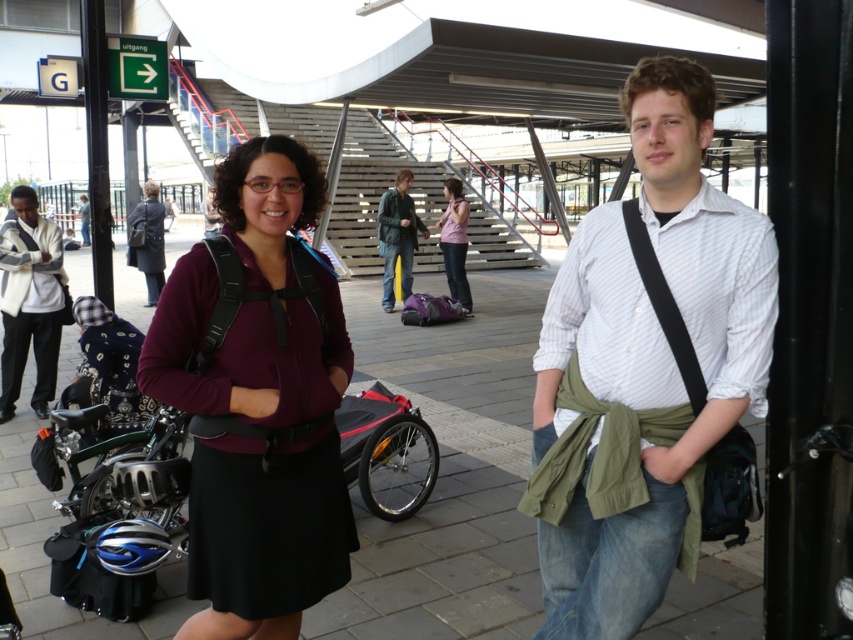
Can you confirm if smooth concrete pavement at center is positioned to the left of matte black backpack at center?

Yes, smooth concrete pavement at center is to the left of matte black backpack at center.

Is smooth concrete pavement at center positioned in front of matte black backpack at center?

No, it is behind matte black backpack at center.

This screenshot has width=853, height=640. Find the location of `smooth concrete pavement at center`. smooth concrete pavement at center is located at coordinates (450, 472).

Can you confirm if matte black backpack at center is positioned to the left of green matte jacket at center?

Incorrect, matte black backpack at center is not on the left side of green matte jacket at center.

In the scene shown: Does matte black backpack at center have a larger size compared to green matte jacket at center?

Incorrect, matte black backpack at center is not larger than green matte jacket at center.

Measure the distance between matte black backpack at center and camera.

6.47 feet

Locate an element on the screen. This screenshot has height=640, width=853. matte black backpack at center is located at coordinates (258, 397).

Does point (64, 604) come farther from viewer compared to point (381, 252)?

No.

Which is in front, point (496, 456) or point (410, 266)?

Point (496, 456)

This screenshot has width=853, height=640. What are the coordinates of `smooth concrete pavement at center` in the screenshot? It's located at (450, 472).